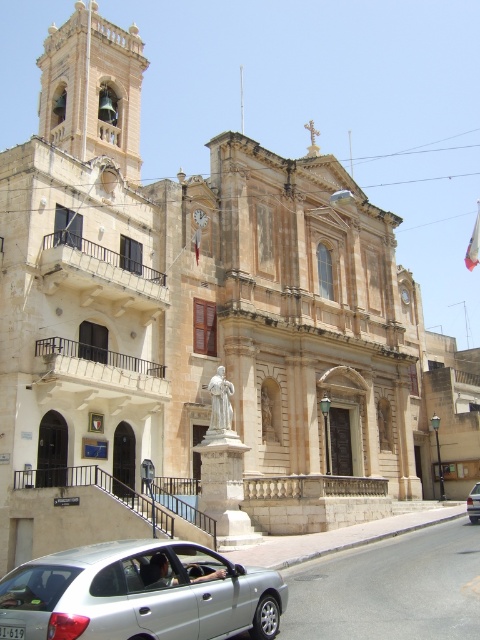
You are a pedestrian standing on the sidewalk in front of the church. You see the silver metallic hatchback at lower left and the silver metallic car at lower right. Which vehicle is closer to you?

The silver metallic hatchback at lower left is closer to you because it is in front of the silver metallic car at lower right.

In the scene shown: You are standing in front of the church and want to park your car. The parking spot is marked by point (140, 595). Where should you drive to park your car?

You should drive to the lower left area where the parking spot marked by point (140, 595) is located, as it corresponds to the silver metallic hatchback at lower left.

You are a pedestrian standing in front of the church and want to cross the street. There are two cars in front of you. Which car should you avoid stepping on first when moving towards the church? The silver metallic hatchback at lower left and the silver metallic car at lower right are both in your path.

You should avoid stepping on the silver metallic hatchback at lower left first because it is positioned to the left of the silver metallic car at lower right, meaning it is closer to your current position as you stand in front of the church.